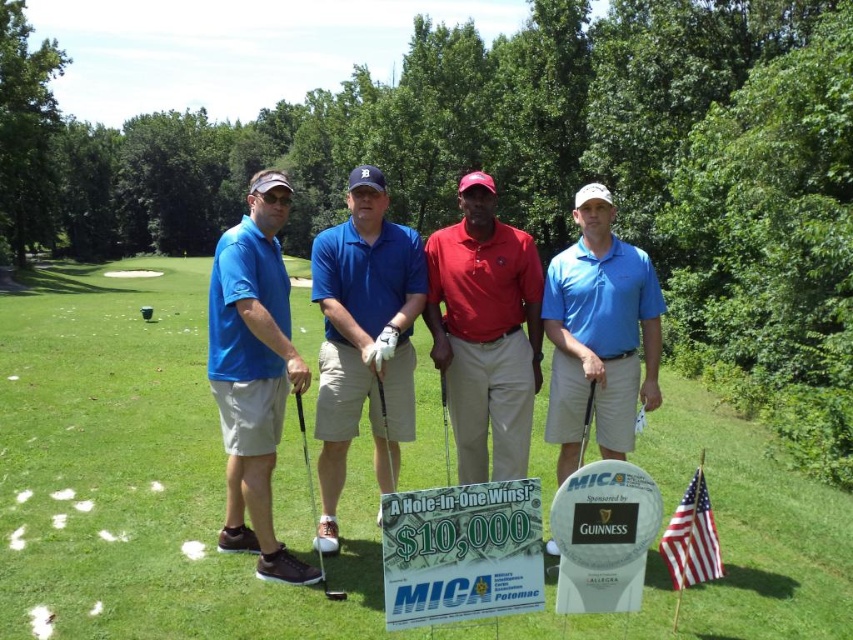
You are a photographer standing 10 feet away from the two people wearing matte red polo shirt at center and matte blue polo shirt at center. You want to take a photo that includes both of them in the frame. Given that your camera has a maximum horizontal field of view of 50 inches, will you be able to capture both individuals in a single shot?

The matte red polo shirt at center and matte blue polo shirt at center are 37.91 inches apart from each other. Since the camera has a maximum horizontal field of view of 50 inches, which is wider than the distance between them, you can capture both individuals in a single shot.

You need to place a small flag exactly at the coordinates mentioned in the scene description. Where should you place the flag in relation to the green grass at center?

The green grass at center is located at point (141, 476), so you should place the flag exactly at those coordinates relative to the green grass at center.

You are a photographer trying to position two golfers wearing the matte red polo shirt at center and the matte blue polo shirt at center for a group photo. Which golfer should you place in the back row to ensure they are not blocked by the other?

The matte red polo shirt at center is much taller than the matte blue polo shirt at center, so you should place the matte red polo shirt at center in the back row to avoid blocking the shorter golfer.